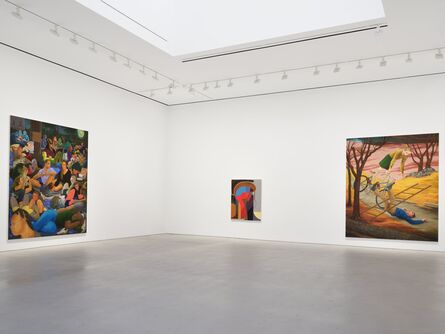
Locate an element on the screen. This screenshot has height=334, width=445. track lights is located at coordinates (291, 69), (141, 64).